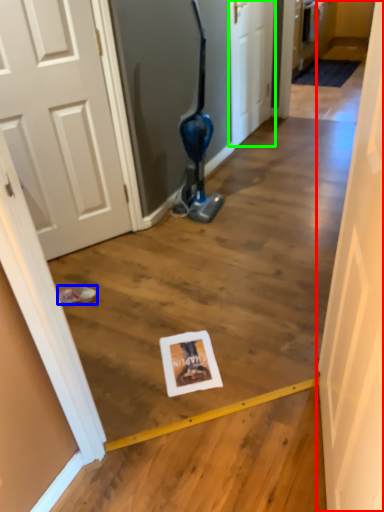
Question: Based on their relative distances, which object is farther from door (highlighted by a red box)? Choose from footwear (highlighted by a blue box) and door (highlighted by a green box).

Choices:
 (A) footwear
 (B) door

Answer: (B)